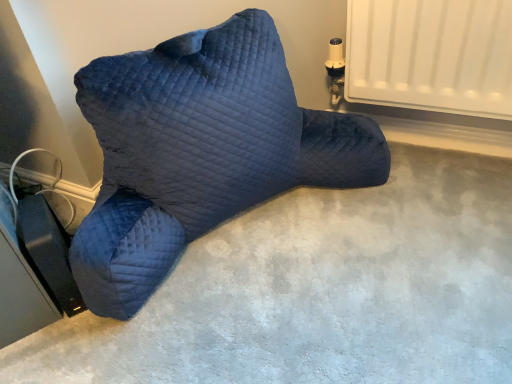
Question: Is velvet blue pillow at center behind velvet blue pillow at center?

Choices:
 (A) yes
 (B) no

Answer: (B)

Question: Does velvet blue pillow at center touch velvet blue pillow at center?

Choices:
 (A) no
 (B) yes

Answer: (A)

Question: Would you say velvet blue pillow at center is part of velvet blue pillow at center's contents?

Choices:
 (A) yes
 (B) no

Answer: (B)

Question: Is velvet blue pillow at center taller than velvet blue pillow at center?

Choices:
 (A) yes
 (B) no

Answer: (B)

Question: From a real-world perspective, is velvet blue pillow at center located beneath velvet blue pillow at center?

Choices:
 (A) no
 (B) yes

Answer: (B)

Question: Does velvet blue pillow at center appear on the left side of velvet blue pillow at center?

Choices:
 (A) no
 (B) yes

Answer: (B)

Question: Considering the relative sizes of velvet blue pillow at center and velvet blue pillow at center in the image provided, is velvet blue pillow at center taller than velvet blue pillow at center?

Choices:
 (A) no
 (B) yes

Answer: (B)

Question: Is velvet blue pillow at center outside of velvet blue pillow at center?

Choices:
 (A) yes
 (B) no

Answer: (A)

Question: Can you confirm if velvet blue pillow at center is positioned to the left of velvet blue pillow at center?

Choices:
 (A) yes
 (B) no

Answer: (B)

Question: Are velvet blue pillow at center and velvet blue pillow at center located far from each other?

Choices:
 (A) yes
 (B) no

Answer: (B)

Question: Is velvet blue pillow at center facing away from velvet blue pillow at center?

Choices:
 (A) yes
 (B) no

Answer: (B)

Question: Is velvet blue pillow at center oriented towards velvet blue pillow at center?

Choices:
 (A) yes
 (B) no

Answer: (B)

Question: Is velvet blue pillow at center inside the boundaries of velvet blue pillow at center, or outside?

Choices:
 (A) inside
 (B) outside

Answer: (B)